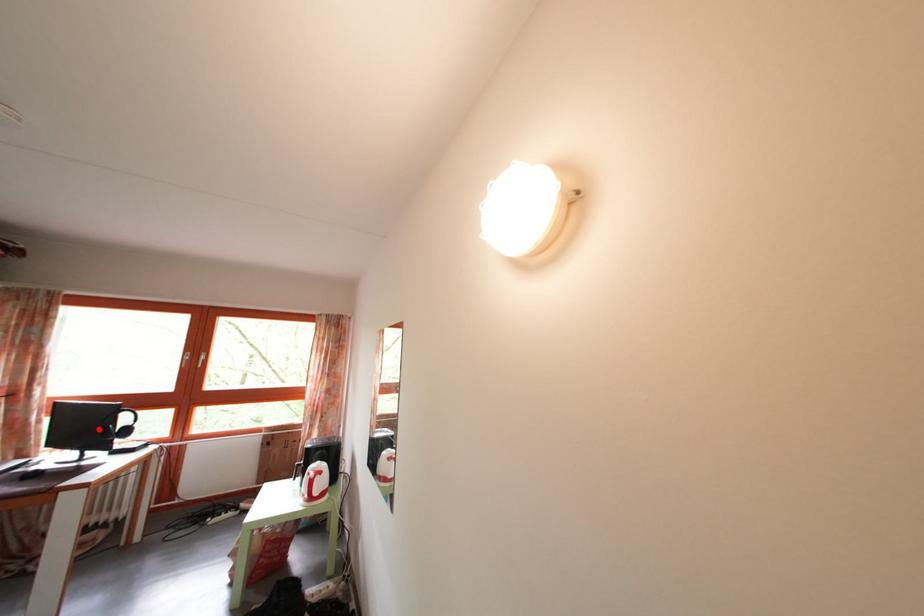
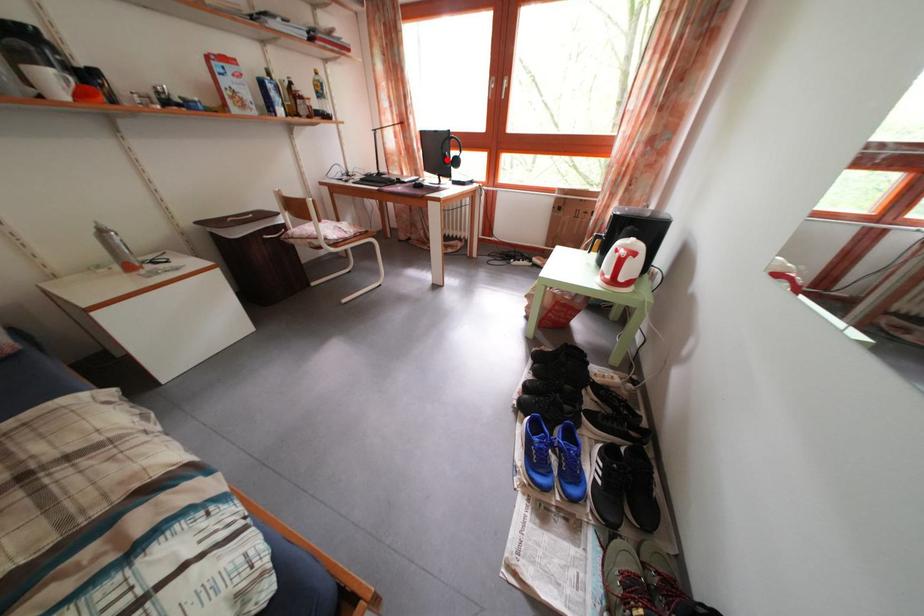
I am providing you with two images of the same scene from different viewpoints. A red point is marked on the first image and another point is marked on the second image. Does the point marked in image1 correspond to the same location as the one in image2?

Yes